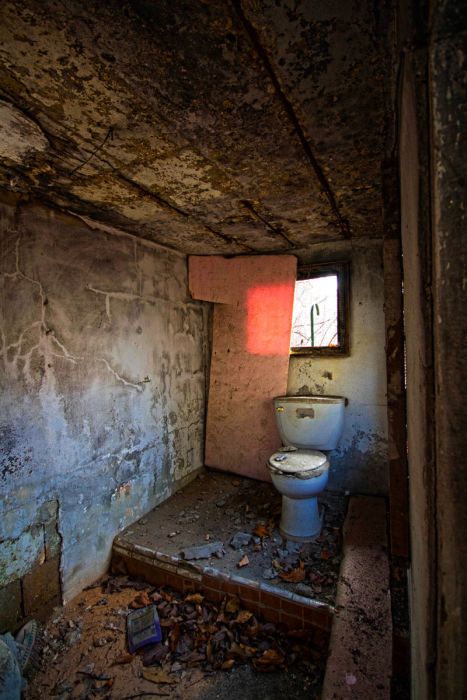
What are the coordinates of `window` in the screenshot? It's located at (300, 309).